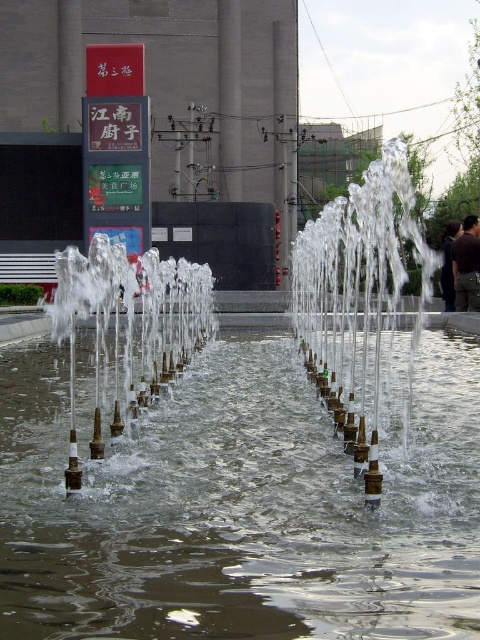
Question: Is clear water at center behind clear water jets at center?

Choices:
 (A) yes
 (B) no

Answer: (B)

Question: Among these objects, which one is farthest from the camera?

Choices:
 (A) clear water at center
 (B) clear water jets at center

Answer: (B)

Question: Among these objects, which one is nearest to the camera?

Choices:
 (A) clear water jets at center
 (B) clear water at center

Answer: (B)

Question: Can you confirm if clear water at center is smaller than clear water jets at center?

Choices:
 (A) yes
 (B) no

Answer: (A)

Question: Is clear water at center thinner than clear water jets at center?

Choices:
 (A) yes
 (B) no

Answer: (A)